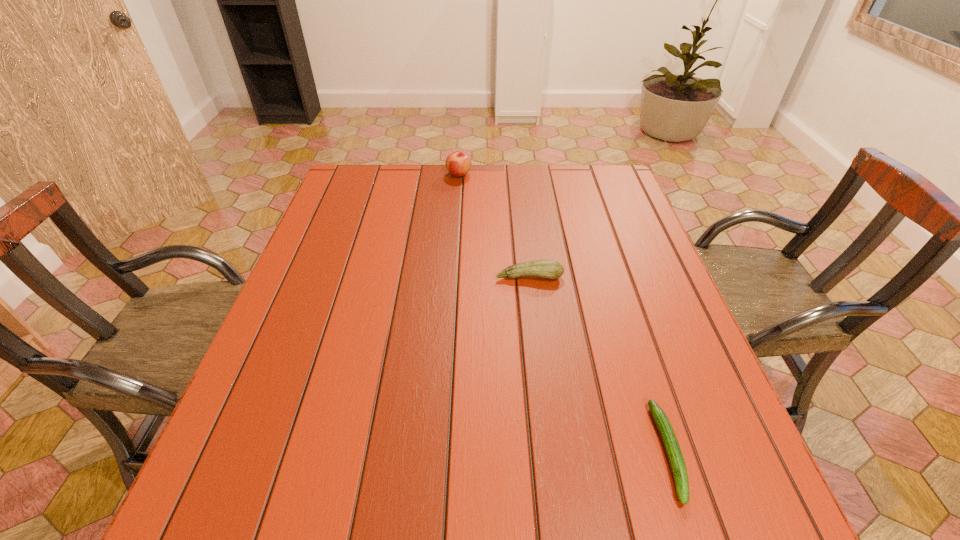
Where is `vacant space that is in between the nearer zucchini and the second tallest object`? This screenshot has height=540, width=960. vacant space that is in between the nearer zucchini and the second tallest object is located at coordinates (599, 364).

At what (x,y) coordinates should I click in order to perform the action: click on vacant space that is in between the apple and the second tallest object. Please return your answer as a coordinate pair (x, y). This screenshot has height=540, width=960. Looking at the image, I should click on (494, 225).

The image size is (960, 540). I want to click on vacant point located between the rightmost object and the leftmost object, so click(x=564, y=313).

This screenshot has height=540, width=960. What are the coordinates of `free spot between the second shortest object and the nearer zucchini` in the screenshot? It's located at [x=599, y=364].

Image resolution: width=960 pixels, height=540 pixels. I want to click on vacant area that lies between the apple and the farther zucchini, so click(494, 225).

Where is `vacant point located between the shorter zucchini and the farthest object`? vacant point located between the shorter zucchini and the farthest object is located at coordinates (564, 313).

The height and width of the screenshot is (540, 960). I want to click on vacant region between the apple and the farther zucchini, so click(494, 225).

Identify the location of vacant space that's between the shortest object and the leftmost object. (564, 313).

Select which object is the second closest to the left zucchini. Please provide its 2D coordinates. Your answer should be formatted as a tuple, i.e. [(x, y)], where the tuple contains the x and y coordinates of a point satisfying the conditions above.

[(458, 163)]

You are a GUI agent. You are given a task and a screenshot of the screen. Output one action in this format:
    pyautogui.click(x=<x>, y=<y>)
    Task: Click on the object that is the closest one to the second tallest object
    
    Given the screenshot: What is the action you would take?
    pyautogui.click(x=674, y=454)